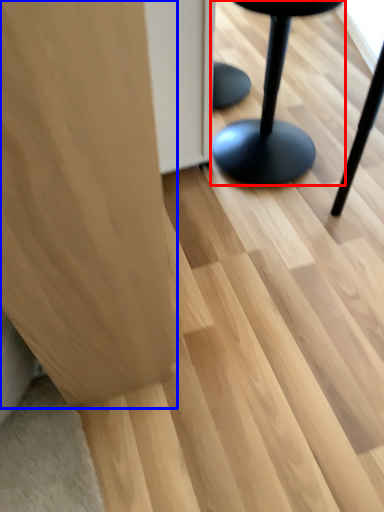
Question: Which point is closer to the camera, furniture (highlighted by a red box) or furniture (highlighted by a blue box)?

Choices:
 (A) furniture
 (B) furniture

Answer: (B)